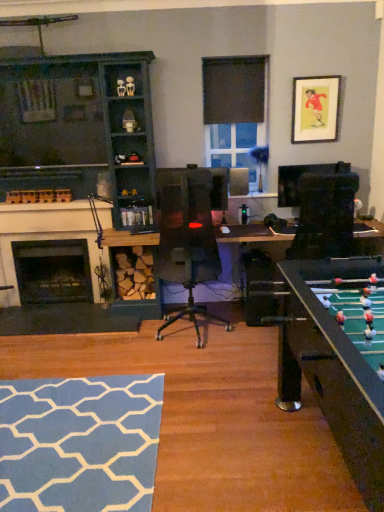
Question: Considering their positions, is black matte fireplace at left, the 1th fireplace from the back, located in front of or behind dark wood cabinet at left?

Choices:
 (A) behind
 (B) front

Answer: (A)

Question: Is black matte fireplace at left, the 2th fireplace positioned from the front, wider or thinner than dark wood cabinet at left?

Choices:
 (A) thin
 (B) wide

Answer: (A)

Question: Which object is the farthest from the black matte fireplace at left, the 2th fireplace positioned from the front?

Choices:
 (A) white painted wood fireplace at left, placed as the second fireplace when sorted from back to front
 (B) blue fabric rug at lower left
 (C) clear glass window at center
 (D) matte paper picture frame at upper right
 (E) black fabric curtain at upper center

Answer: (D)

Question: Which is farther from the clear glass window at center?

Choices:
 (A) black fabric curtain at upper center
 (B) blue fabric rug at lower left
 (C) black matte fireplace at left, the 1th fireplace from the back
 (D) dark wood cabinet at left
 (E) white painted wood fireplace at left, the 1th fireplace in the front-to-back sequence

Answer: (B)